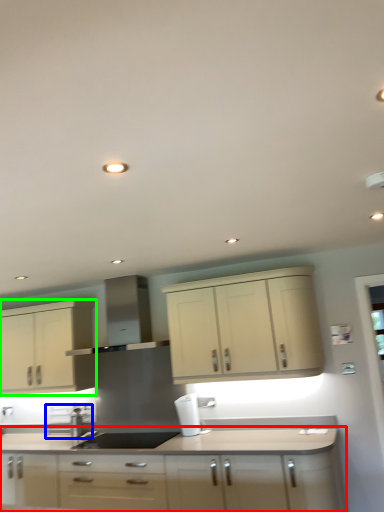
Question: Based on their relative distances, which object is farther from cabinetry (highlighted by a red box)? Choose from appliance (highlighted by a blue box) and cabinetry (highlighted by a green box).

Choices:
 (A) appliance
 (B) cabinetry

Answer: (A)